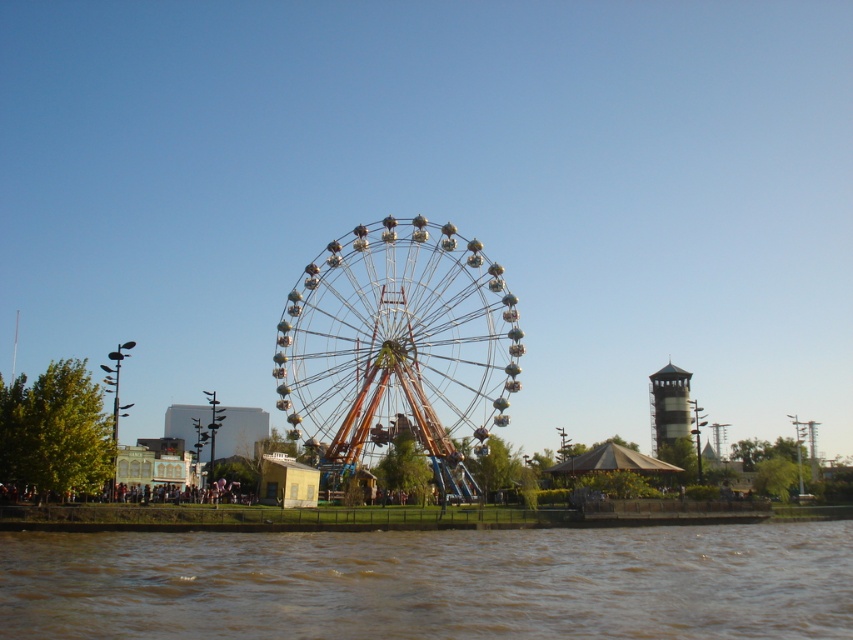
Between brown muddy water at lower center and metallic gray tower at right, which one has less height?

brown muddy water at lower center

Measure the distance between brown muddy water at lower center and camera.

brown muddy water at lower center is 120.42 meters from camera.

This screenshot has width=853, height=640. I want to click on brown muddy water at lower center, so click(433, 582).

Find the location of `brown muddy water at lower center`. brown muddy water at lower center is located at coordinates (433, 582).

Who is more distant from viewer, (309,588) or (305,339)?

Positioned behind is point (305,339).

Does brown muddy water at lower center appear on the left side of metallic silver ferris wheel at center?

No, brown muddy water at lower center is not to the left of metallic silver ferris wheel at center.

This screenshot has width=853, height=640. What do you see at coordinates (433, 582) in the screenshot?
I see `brown muddy water at lower center` at bounding box center [433, 582].

Locate an element on the screen. This screenshot has height=640, width=853. brown muddy water at lower center is located at coordinates (433, 582).

Can you confirm if metallic silver ferris wheel at center is shorter than metallic gray tower at right?

No.

Is metallic silver ferris wheel at center taller than metallic gray tower at right?

Correct, metallic silver ferris wheel at center is much taller as metallic gray tower at right.

Between point (340, 403) and point (663, 369), which one is positioned in front?

Point (340, 403) is in front.

I want to click on metallic silver ferris wheel at center, so click(x=398, y=349).